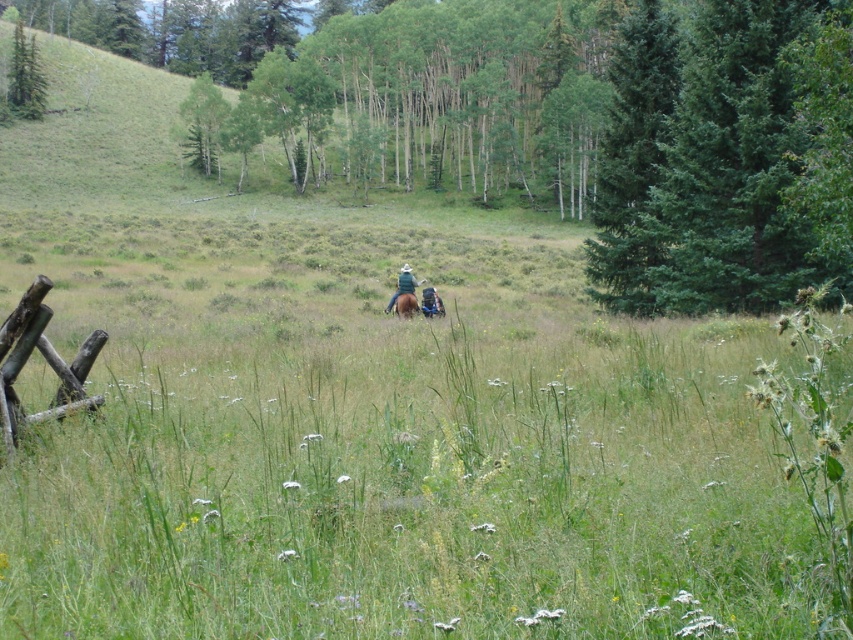
From the picture: You are standing at the edge of the field in the image and want to cross to the other side. There is a brown wooden fence at lower left and a brown matte horse at center. Which object is closer to you, and would you need to go around it to reach the other side?

The brown wooden fence at lower left is in front of the brown matte horse at center, so it is closer to you. You would need to go around the brown wooden fence at lower left first before proceeding further.